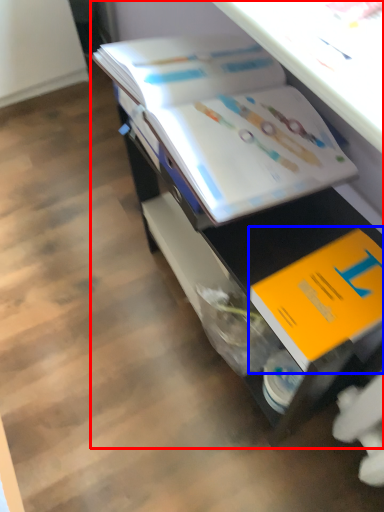
Question: Among these objects, which one is farthest to the camera, desk (highlighted by a red box) or book (highlighted by a blue box)?

Choices:
 (A) desk
 (B) book

Answer: (B)